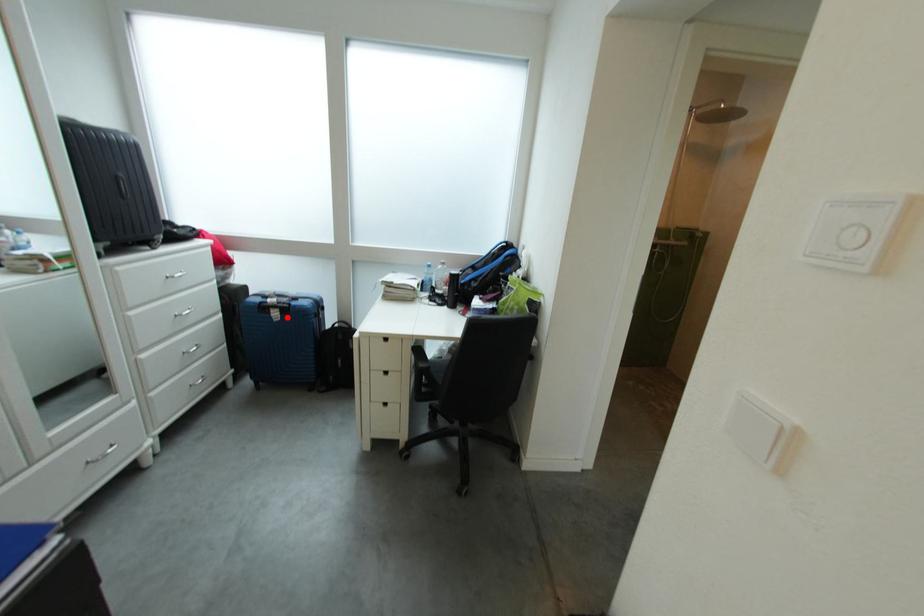
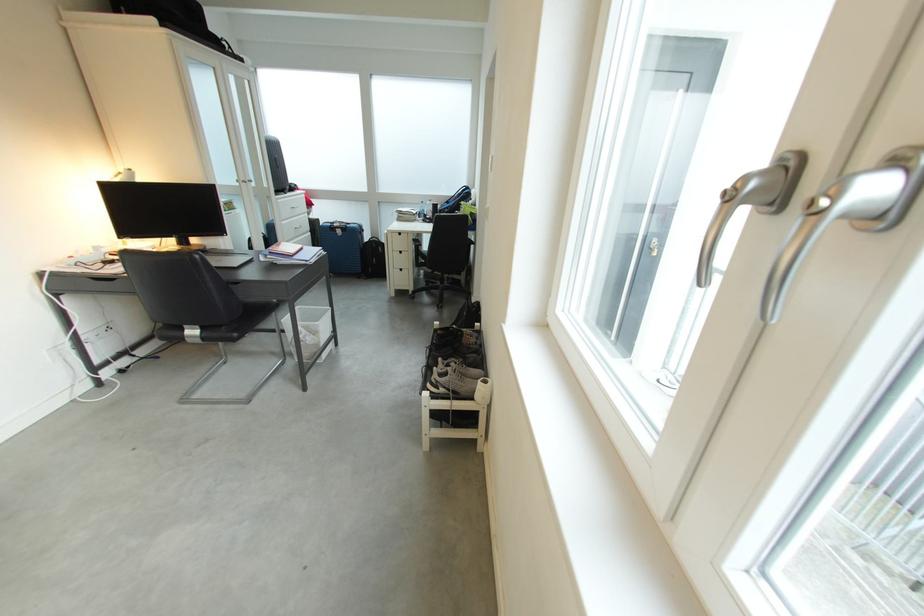
Question: I am providing you with two images of the same scene from different viewpoints. In image1, a red point is highlighted. Considering the same 3D point in image2, which of the following is correct?

Choices:
 (A) It is closer
 (B) It is farther

Answer: (A)